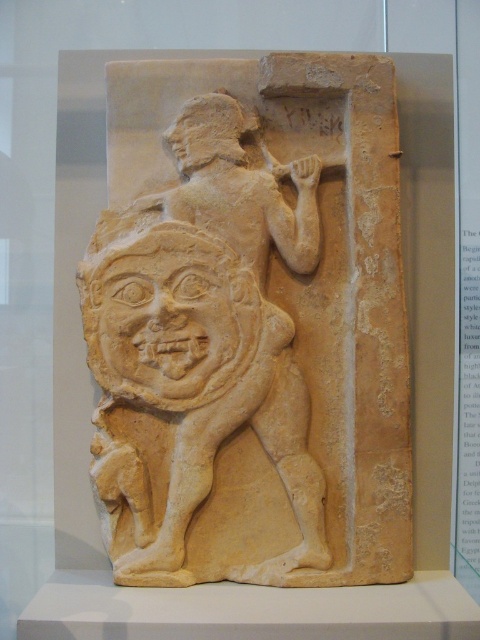
Question: Can you confirm if beige stone relief at center is smaller than beige stone warrior at center?

Choices:
 (A) yes
 (B) no

Answer: (B)

Question: Is beige stone relief at center further to camera compared to beige stone warrior at center?

Choices:
 (A) yes
 (B) no

Answer: (B)

Question: Which point is farther to the camera?

Choices:
 (A) beige stone relief at center
 (B) beige stone warrior at center

Answer: (B)

Question: Does beige stone relief at center have a smaller size compared to beige stone warrior at center?

Choices:
 (A) no
 (B) yes

Answer: (A)

Question: Which point is closer to the camera?

Choices:
 (A) beige stone warrior at center
 (B) beige stone relief at center

Answer: (B)